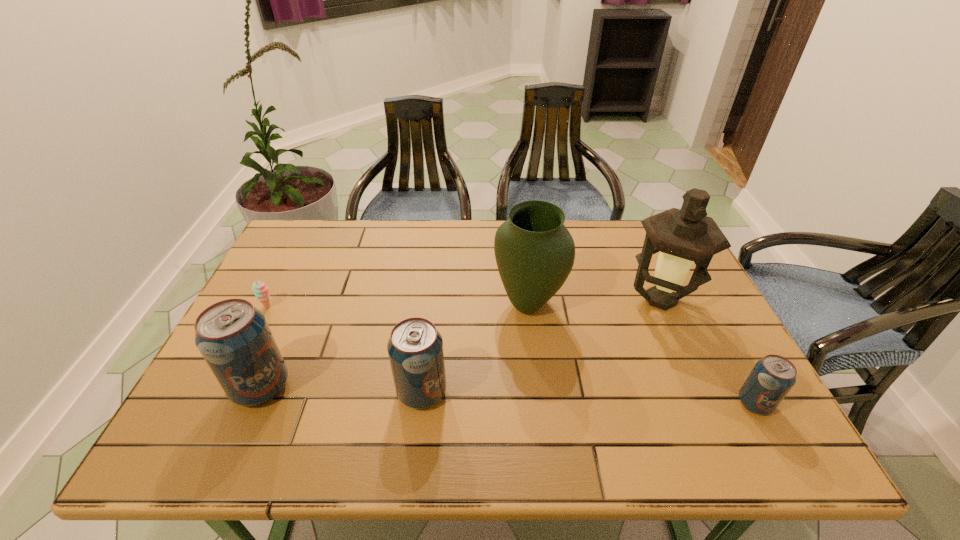
Image resolution: width=960 pixels, height=540 pixels. In order to click on object present at the near right corner in this screenshot , I will do coord(772,377).

Image resolution: width=960 pixels, height=540 pixels. I want to click on vacant space at the far edge of the desktop, so click(x=408, y=244).

In the image, there is a desktop. At what (x,y) coordinates should I click in order to perform the action: click on vacant space at the left edge. Please return your answer as a coordinate pair (x, y). Image resolution: width=960 pixels, height=540 pixels. Looking at the image, I should click on pyautogui.click(x=273, y=275).

Where is `vacant area at the right edge`? vacant area at the right edge is located at coordinates (690, 362).

I want to click on vacant space at the near left corner of the desktop, so click(202, 413).

Where is `free space at the far right corner of the desktop`? free space at the far right corner of the desktop is located at coordinates (637, 231).

Image resolution: width=960 pixels, height=540 pixels. I want to click on free spot between the shortest object and the second tallest pop soda, so click(345, 349).

Locate an element on the screen. The image size is (960, 540). vacant space that's between the second tallest object and the oil lamp is located at coordinates (594, 302).

The width and height of the screenshot is (960, 540). I want to click on vacant area between the vase and the shortest object, so click(x=398, y=305).

Where is `free space between the oil lamp and the shortest object`? The width and height of the screenshot is (960, 540). free space between the oil lamp and the shortest object is located at coordinates (465, 303).